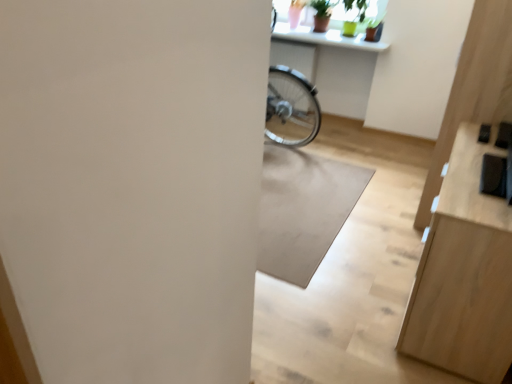
Question: Is white glossy counter top at upper center situated inside white matte mat at center or outside?

Choices:
 (A) inside
 (B) outside

Answer: (B)

Question: From their relative heights in the image, would you say white glossy counter top at upper center is taller or shorter than white matte mat at center?

Choices:
 (A) tall
 (B) short

Answer: (A)

Question: Estimate the real-world distances between objects in this image. Which object is farther from the white matte mat at center?

Choices:
 (A) white glossy counter top at upper center
 (B) light wood dresser at right

Answer: (A)

Question: Considering the real-world distances, which object is farthest from the white glossy counter top at upper center?

Choices:
 (A) light wood dresser at right
 (B) white matte mat at center

Answer: (A)